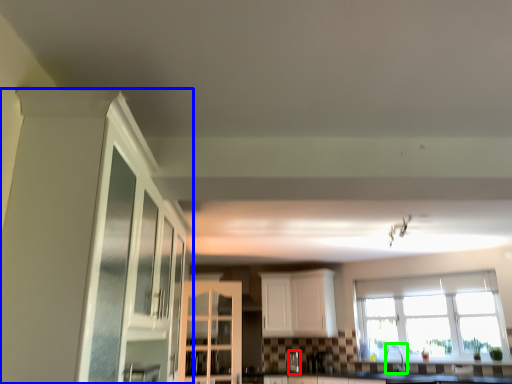
Question: Considering the real-world distances, which object is farthest from silver (highlighted by a red box)? cabinetry (highlighted by a blue box) or faucet (highlighted by a green box)?

Choices:
 (A) cabinetry
 (B) faucet

Answer: (A)